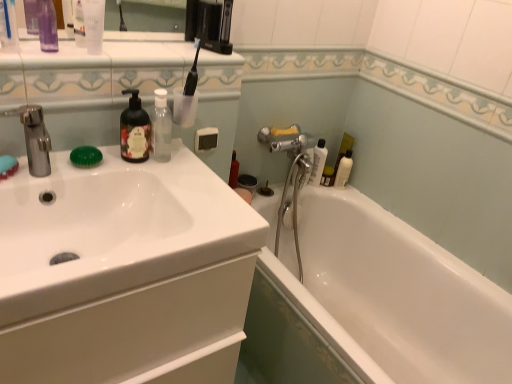
Where is `vacant area that is situated to the right of matte black soap dispenser at upper left`? This screenshot has width=512, height=384. vacant area that is situated to the right of matte black soap dispenser at upper left is located at coordinates (180, 176).